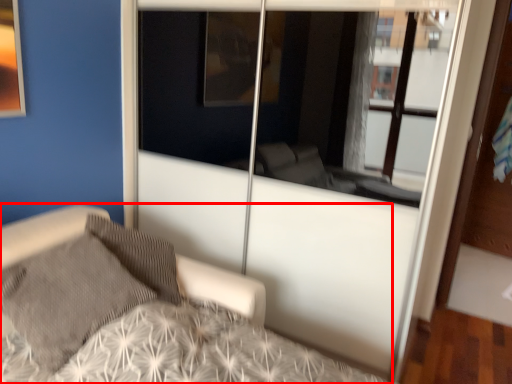
Question: Where is bed (annotated by the red box) located in relation to pillow in the image?

Choices:
 (A) right
 (B) left

Answer: (A)